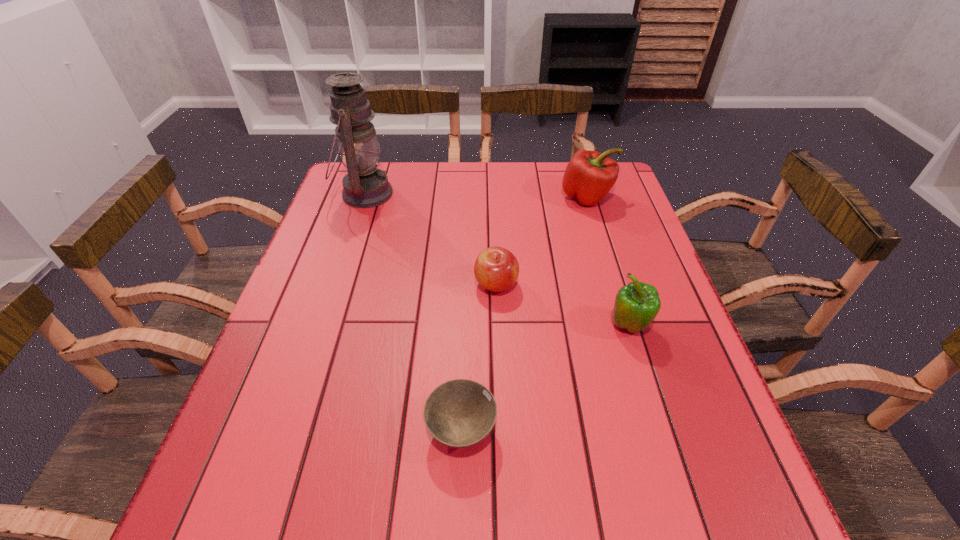
The image size is (960, 540). I want to click on blank space located 0.320m on the back of the fourth farthest object, so click(x=597, y=226).

Find the location of a particular element. This screenshot has width=960, height=540. free space located 0.230m on the back of the third farthest object is located at coordinates (493, 215).

The height and width of the screenshot is (540, 960). Find the location of `free space located on the right of the nearest object`. free space located on the right of the nearest object is located at coordinates (717, 430).

Where is `oil lamp situated at the far edge`? The width and height of the screenshot is (960, 540). oil lamp situated at the far edge is located at coordinates (365, 186).

You are a GUI agent. You are given a task and a screenshot of the screen. Output one action in this format:
    pyautogui.click(x=<x>, y=<y>)
    Task: Click on the bell pepper situated at the far edge
    The height and width of the screenshot is (540, 960).
    Given the screenshot: What is the action you would take?
    pyautogui.click(x=589, y=176)

At what (x,y) coordinates should I click in order to perform the action: click on object present at the left edge. Please return your answer as a coordinate pair (x, y). The width and height of the screenshot is (960, 540). Looking at the image, I should click on (365, 186).

Where is `object present at the far left corner`? object present at the far left corner is located at coordinates coord(365,186).

This screenshot has height=540, width=960. In order to click on object positioned at the far right corner in this screenshot , I will do `click(589, 176)`.

Locate an element on the screen. free region at the far edge of the desktop is located at coordinates (429, 183).

At what (x,y) coordinates should I click in order to perform the action: click on free space at the near edge of the desktop. Please return your answer as a coordinate pair (x, y). Looking at the image, I should click on (384, 487).